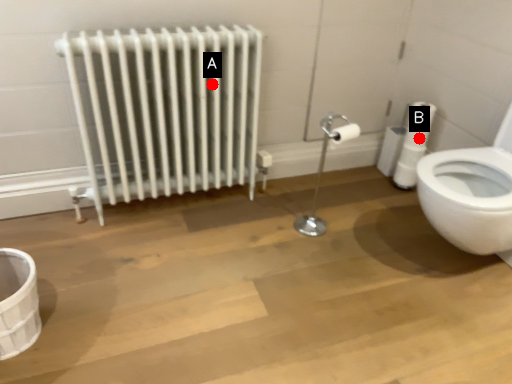
Question: Two points are circled on the image, labeled by A and B beside each circle. Which point is closer to the camera taking this photo?

Choices:
 (A) A is closer
 (B) B is closer

Answer: (A)